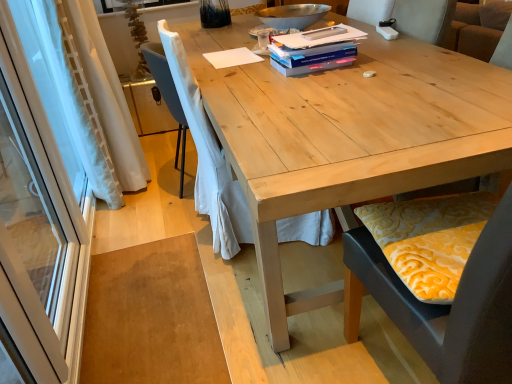
Question: Considering the positions of blue matte paperback book at upper center, which is the second paperback book in top-to-bottom order, and white sheer curtain at left, the 1th curtain viewed from the back, in the image, is blue matte paperback book at upper center, which is the second paperback book in top-to-bottom order, bigger or smaller than white sheer curtain at left, the 1th curtain viewed from the back,?

Choices:
 (A) small
 (B) big

Answer: (A)

Question: From the image's perspective, is blue matte paperback book at upper center, which is the second paperback book in top-to-bottom order, above or below white sheer curtain at left, the second curtain in the front-to-back sequence?

Choices:
 (A) above
 (B) below

Answer: (A)

Question: Based on their relative distances, which object is nearer to the white plastic remote control at upper center?

Choices:
 (A) natural wood table at center
 (B) blue matte paperback book at upper center, which is the second paperback book in top-to-bottom order
 (C) yellow patterned cushion at lower right, marked as the 2th chair in a left-to-right arrangement
 (D) transparent glass screen door at left
 (E) metallic silver bowl at upper center

Answer: (B)

Question: Based on their relative distances, which object is farther from the blue matte paperback book at upper center, the 2th paperback book ordered from the bottom?

Choices:
 (A) blue matte paperback book at center, which is the third paperback book from top to bottom
 (B) natural wood table at center
 (C) blue matte paperback book at upper center, the 1th paperback book from the top
 (D) white plastic remote control at upper center
 (E) white sheer curtain at left, the 1th curtain viewed from the back

Answer: (E)